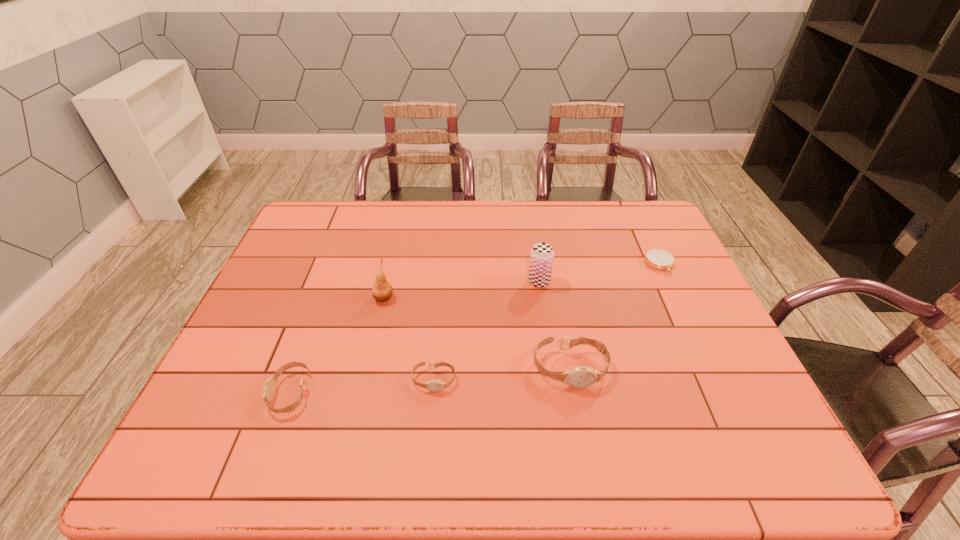
You are a GUI agent. You are given a task and a screenshot of the screen. Output one action in this format:
    pyautogui.click(x=<x>, y=<y>)
    Task: Click on the free region that satisfies the following two spatial constraints: 1. on the face of the rightmost watch; 2. on the face of the third shortest object
    The height and width of the screenshot is (540, 960).
    Given the screenshot: What is the action you would take?
    pyautogui.click(x=575, y=393)

Find the location of a particular element. free space that satisfies the following two spatial constraints: 1. on the face of the rightmost watch; 2. on the face of the third shortest object is located at coordinates (575, 393).

Where is `free space that satisfies the following two spatial constraints: 1. on the face of the rightmost watch; 2. on the face of the leftmost object`? The image size is (960, 540). free space that satisfies the following two spatial constraints: 1. on the face of the rightmost watch; 2. on the face of the leftmost object is located at coordinates (575, 393).